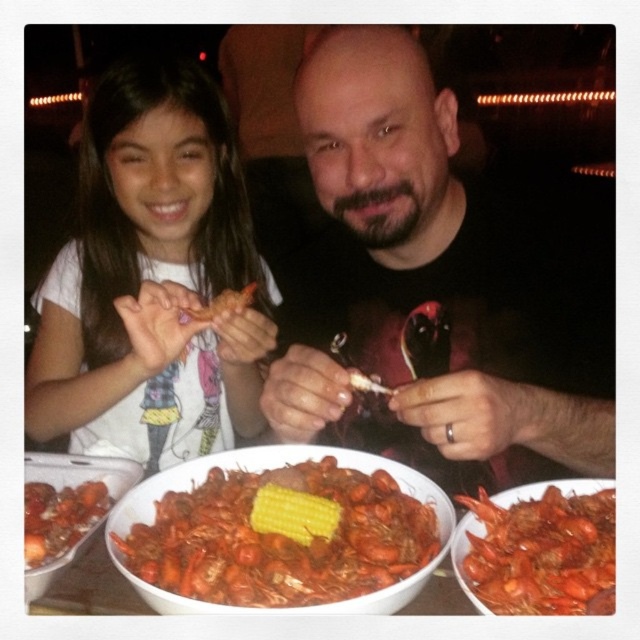
You are a food critic evaluating the presentation of this crawfish boil. Which crawfish, the shiny red crawfish at center or the shiny orange crawfish at center, has a larger size in terms of width?

The shiny red crawfish at center has a larger width than the shiny orange crawfish at center according to the description provided.

You are a food critic attending a crawfish boil event. You notice two items at the center of the bowls. Which item is positioned lower between the shiny red crawfish at center and the yellow matte corn at center?

The shiny red crawfish at center is positioned lower than the yellow matte corn at center according to the description.